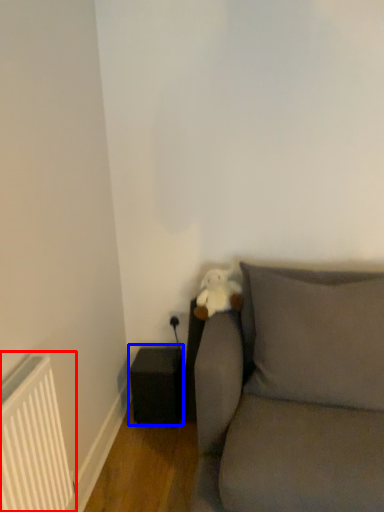
Question: Which object appears closest to the camera in this image, radiator (highlighted by a red box) or speaker (highlighted by a blue box)?

Choices:
 (A) radiator
 (B) speaker

Answer: (A)